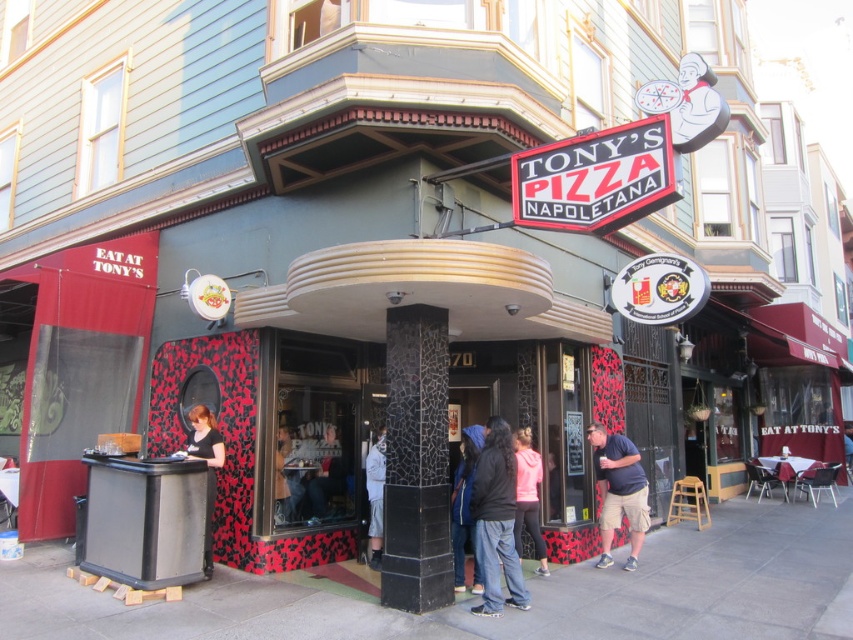
Question: Which of the following is the farthest from the observer?

Choices:
 (A) white cotton shirt at center
 (B) pink matte jacket at center

Answer: (A)

Question: Which point is closer to the camera?

Choices:
 (A) (498, 442)
 (B) (476, 428)
 (C) (206, 445)

Answer: (A)

Question: Is matte black shirt at lower left smaller than black leather jacket at lower left?

Choices:
 (A) yes
 (B) no

Answer: (B)

Question: Does denim pants at center appear on the left side of black leather jacket at lower left?

Choices:
 (A) no
 (B) yes

Answer: (A)

Question: Is matte black shirt at lower left above black leather jacket at lower left?

Choices:
 (A) no
 (B) yes

Answer: (A)

Question: Which point is closer to the camera?

Choices:
 (A) (705, 504)
 (B) (193, 449)
 (C) (521, 552)

Answer: (B)